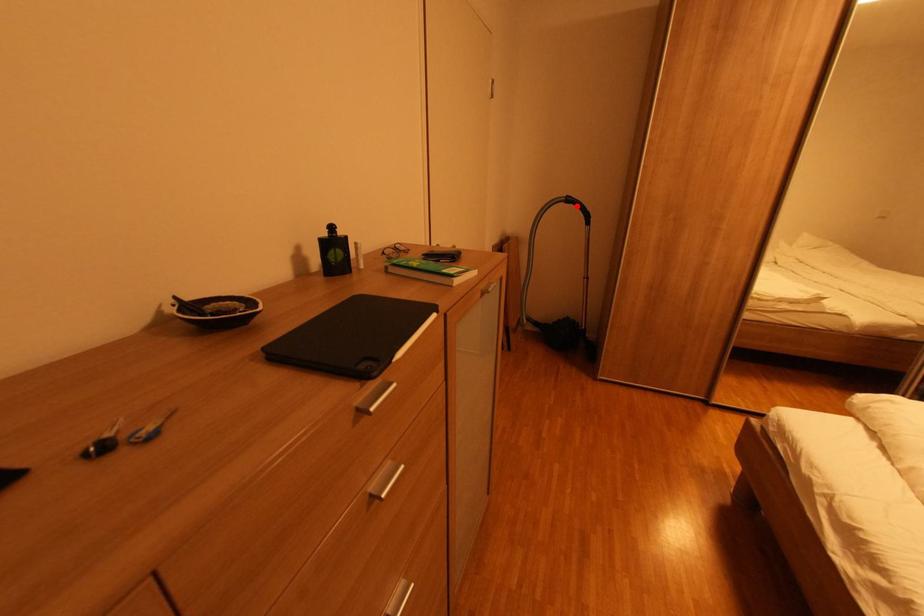
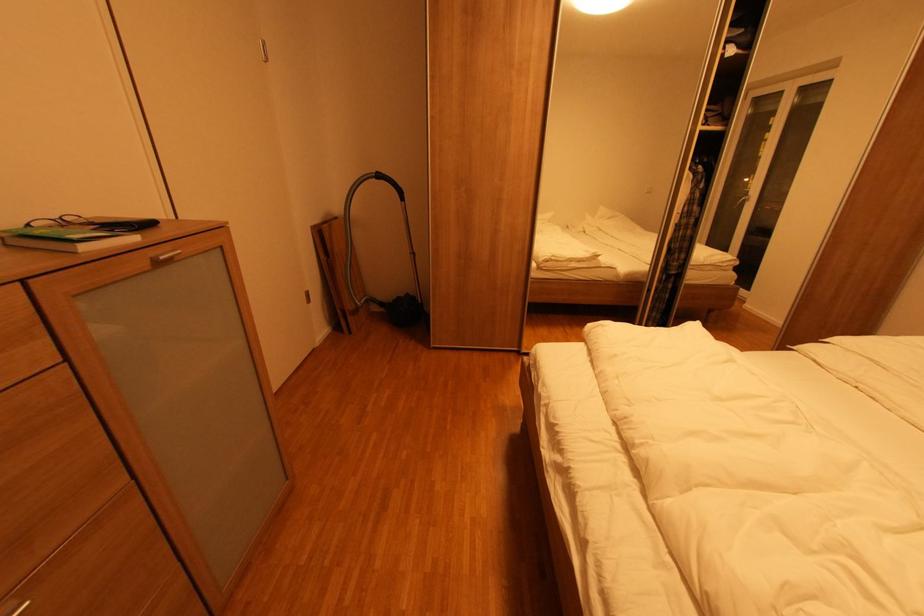
Where in the second image is the point corresponding to the highlighted location from the first image?

(387, 182)